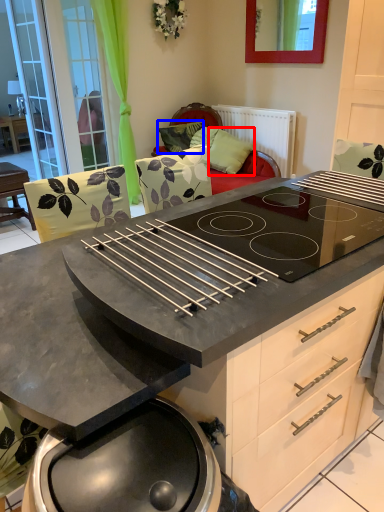
Question: Which object is further to the camera taking this photo, pillow (highlighted by a red box) or pillow (highlighted by a blue box)?

Choices:
 (A) pillow
 (B) pillow

Answer: (B)